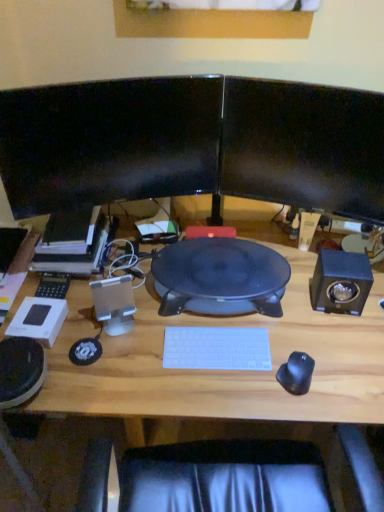
This screenshot has width=384, height=512. Find the location of `free space behind black rubberized mouse at right`. free space behind black rubberized mouse at right is located at coordinates (288, 334).